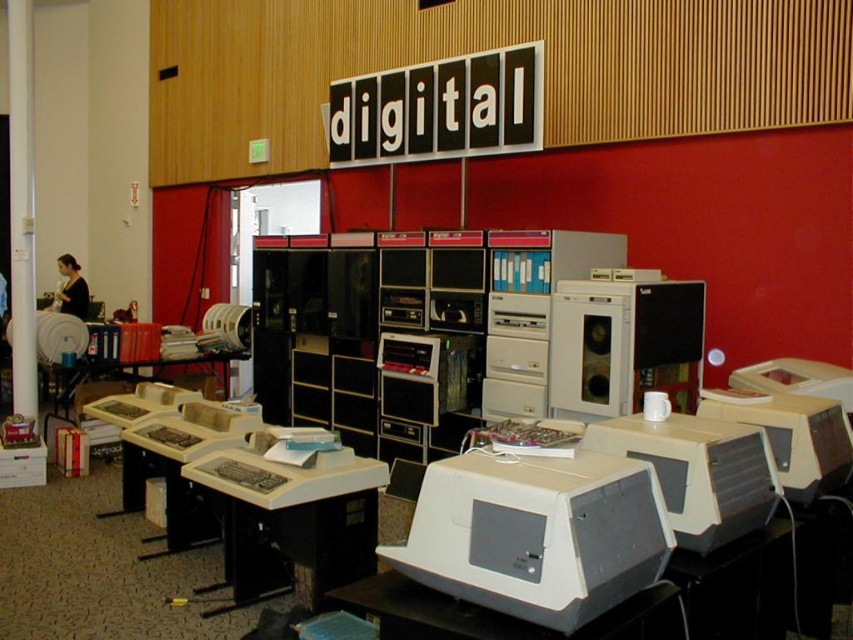
You are a museum guide explaining the layout of this vintage computer exhibit. You mention both the gray plastic monitor at center and the matte black desktop computer at center. Which one is located to the left of the other?

The gray plastic monitor at center is positioned on the left side of matte black desktop computer at center.

You are a visitor at a tech museum and want to read the information on the black plastic sign at upper center and the matte gray desktop computer at center. Which one do you need to look up closer?

The black plastic sign at upper center is larger in size than the matte gray desktop computer at center, so you can read it from a closer distance.